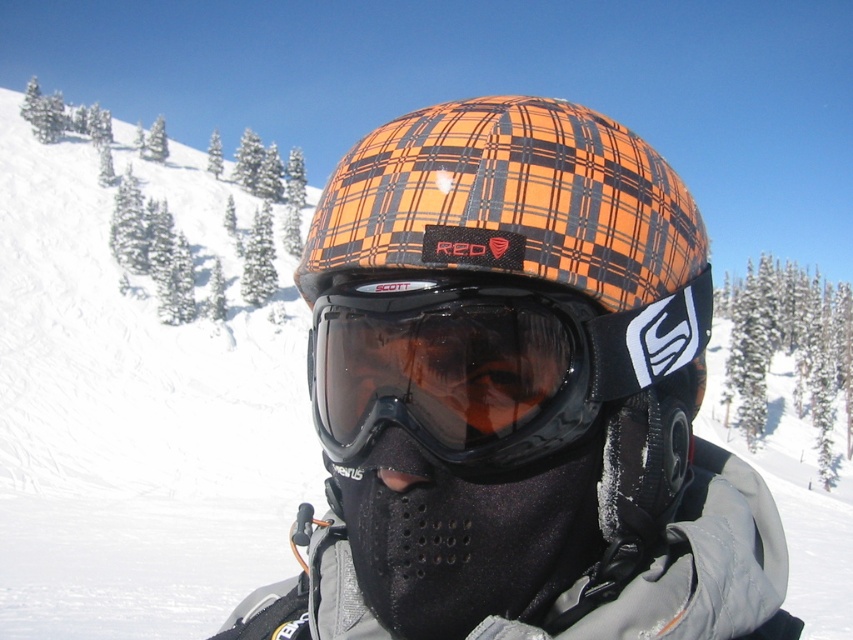
Question: Which object appears farthest from the camera in this image?

Choices:
 (A) orange plaid helmet at center
 (B) transparent plastic goggles at center

Answer: (A)

Question: Which point is closer to the camera?

Choices:
 (A) transparent plastic goggles at center
 (B) orange plaid helmet at center

Answer: (A)

Question: Can you confirm if orange plaid helmet at center is thinner than transparent plastic goggles at center?

Choices:
 (A) yes
 (B) no

Answer: (B)

Question: Is orange plaid helmet at center further to the viewer compared to transparent plastic goggles at center?

Choices:
 (A) no
 (B) yes

Answer: (B)

Question: Which object is closer to the camera taking this photo?

Choices:
 (A) transparent plastic goggles at center
 (B) orange plaid helmet at center

Answer: (A)

Question: Is orange plaid helmet at center bigger than transparent plastic goggles at center?

Choices:
 (A) no
 (B) yes

Answer: (B)